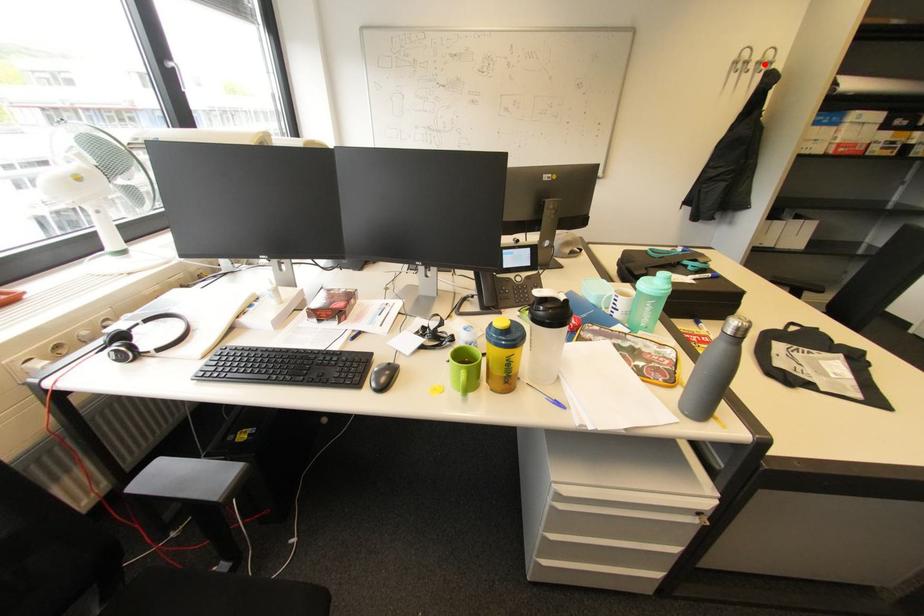
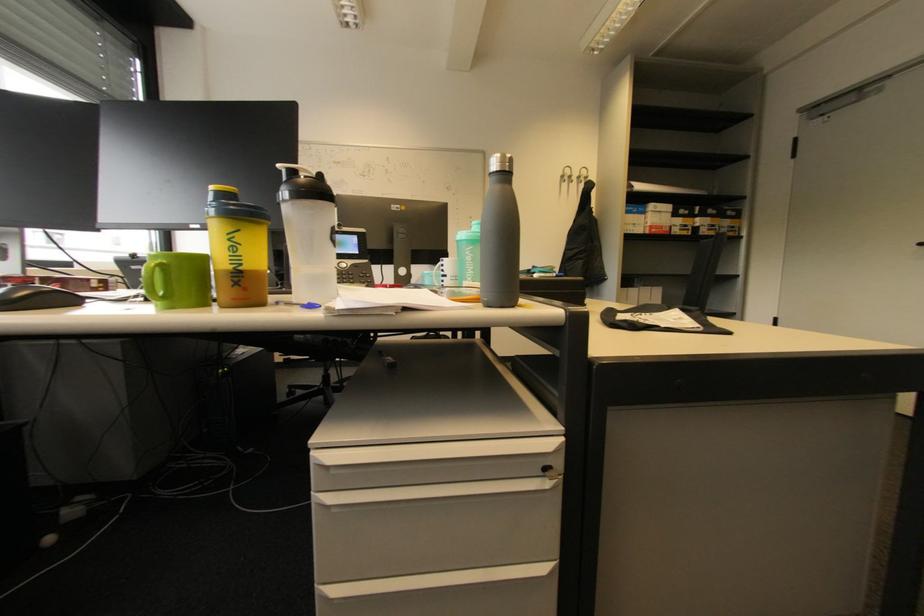
Question: I am providing you with two images of the same scene from different viewpoints. Given a red point in image1, look at the same physical point in image2. Is it:

Choices:
 (A) Closer to the viewpoint
 (B) Farther from the viewpoint

Answer: (A)